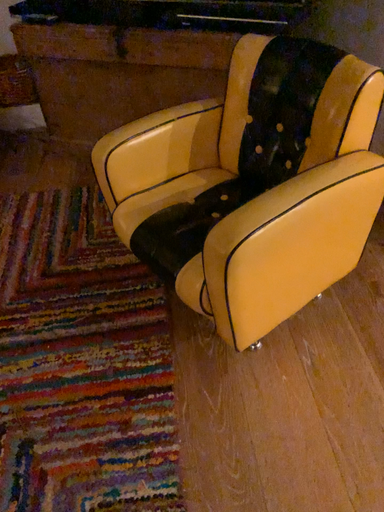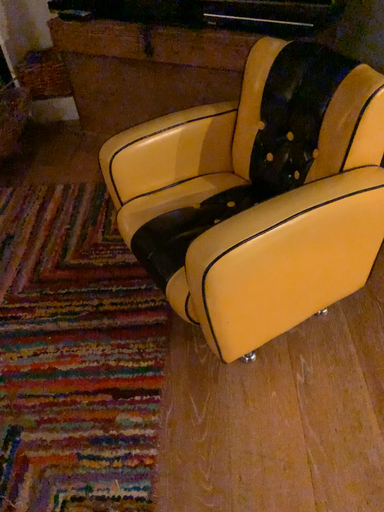
Question: Which way did the camera rotate in the video?

Choices:
 (A) rotated left
 (B) rotated right

Answer: (A)